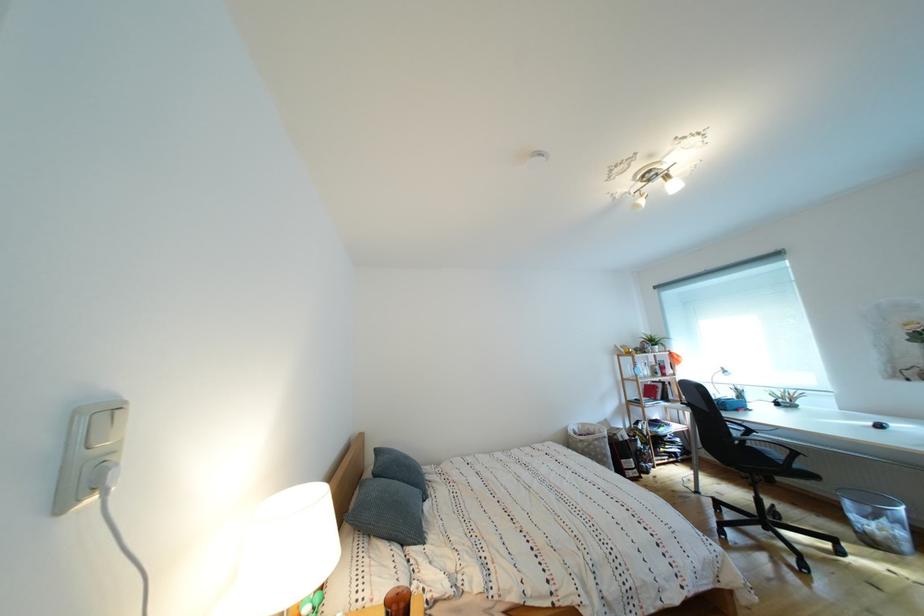
Image resolution: width=924 pixels, height=616 pixels. What do you see at coordinates (759, 447) in the screenshot? I see `a chair armrest` at bounding box center [759, 447].